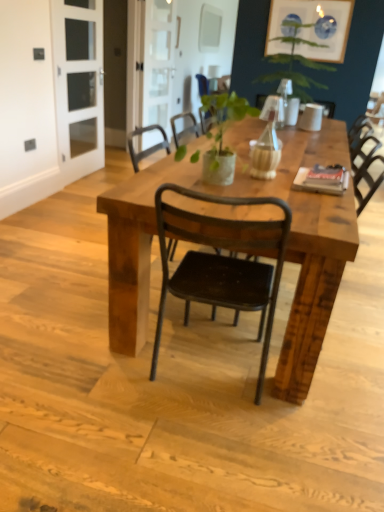
The height and width of the screenshot is (512, 384). Describe the element at coordinates (242, 196) in the screenshot. I see `rustic wood table at center` at that location.

Find the location of a particular element. matte blue glass picture frame at upper right is located at coordinates (310, 28).

The width and height of the screenshot is (384, 512). What are the coordinates of `clear glass screen door at upper center, the 1th screen door viewed from the back` in the screenshot? It's located at (159, 62).

The width and height of the screenshot is (384, 512). What do you see at coordinates (222, 135) in the screenshot? I see `green matte plant at center` at bounding box center [222, 135].

The height and width of the screenshot is (512, 384). I want to click on green leafy plant at upper center, so click(299, 55).

Identify the location of rustic wood table at center. (242, 196).

From the image's perspective, between clear glass door at upper left, the first screen door viewed from the left, and black metal chair at center, arranged as the first chair when viewed from the front, who is located below?

black metal chair at center, arranged as the first chair when viewed from the front, appears lower in the image.

Is clear glass door at upper left, the first screen door viewed from the left, outside of black metal chair at center, the second chair when ordered from back to front?

clear glass door at upper left, the first screen door viewed from the left, lies outside black metal chair at center, the second chair when ordered from back to front,'s area.

Is clear glass door at upper left, the 2th screen door from the back, taller or shorter than black metal chair at center, arranged as the first chair when viewed from the front?

Considering their sizes, clear glass door at upper left, the 2th screen door from the back, has more height than black metal chair at center, arranged as the first chair when viewed from the front.

Are matte blue glass picture frame at upper right and green leafy plant at upper center making contact?

Indeed, matte blue glass picture frame at upper right and green leafy plant at upper center are beside each other and touching.

From the image's perspective, which is below, matte blue glass picture frame at upper right or green leafy plant at upper center?

green leafy plant at upper center is shown below in the image.

Considering the sizes of matte blue glass picture frame at upper right and green leafy plant at upper center in the image, is matte blue glass picture frame at upper right taller or shorter than green leafy plant at upper center?

Clearly, matte blue glass picture frame at upper right is shorter compared to green leafy plant at upper center.

Does point (314, 32) appear closer or farther from the camera than point (290, 31)?

Point (314, 32) is positioned closer to the camera compared to point (290, 31).

From the picture: How much distance is there between matte blue glass picture frame at upper right and green matte plant at center?

The distance of matte blue glass picture frame at upper right from green matte plant at center is 1.75 meters.

From a real-world perspective, is matte blue glass picture frame at upper right over green matte plant at center?

Yes, from a real-world perspective, matte blue glass picture frame at upper right is over green matte plant at center

Is there a large distance between matte blue glass picture frame at upper right and green matte plant at center?

matte blue glass picture frame at upper right is far away from green matte plant at center.

Is matte blue glass picture frame at upper right smaller than green matte plant at center?

Correct, matte blue glass picture frame at upper right occupies less space than green matte plant at center.

Would you say green matte plant at center is inside or outside clear glass screen door at upper center, which is the 2th screen door in front-to-back order?

green matte plant at center exists outside the volume of clear glass screen door at upper center, which is the 2th screen door in front-to-back order.

Is green matte plant at center oriented towards clear glass screen door at upper center, the first screen door when ordered from right to left?

No.

Considering the relative positions of green matte plant at center and clear glass screen door at upper center, the first screen door when ordered from right to left, in the image provided, is green matte plant at center to the left or to the right of clear glass screen door at upper center, the first screen door when ordered from right to left,?

green matte plant at center is to the right of clear glass screen door at upper center, the first screen door when ordered from right to left.

Considering the sizes of green matte plant at center and clear glass screen door at upper center, which is the 2th screen door in front-to-back order, in the image, is green matte plant at center wider or thinner than clear glass screen door at upper center, which is the 2th screen door in front-to-back order,?

In the image, green matte plant at center appears to be wider than clear glass screen door at upper center, which is the 2th screen door in front-to-back order.

From a real-world perspective, between clear glass door at upper left, the second screen door from the right, and black metal chair at center, the 2th chair positioned from the bottom, who is vertically higher?

In real-world perspective, clear glass door at upper left, the second screen door from the right, is above.

Can you confirm if clear glass door at upper left, the second screen door from the right, is smaller than black metal chair at center, the first chair in the top-to-bottom sequence?

Yes, clear glass door at upper left, the second screen door from the right, is smaller than black metal chair at center, the first chair in the top-to-bottom sequence.

Measure the distance from clear glass door at upper left, the 2th screen door from the back, to black metal chair at center, which is counted as the 2th chair, starting from the front.

The distance of clear glass door at upper left, the 2th screen door from the back, from black metal chair at center, which is counted as the 2th chair, starting from the front, is 1.41 meters.

You are a GUI agent. You are given a task and a screenshot of the screen. Output one action in this format:
    pyautogui.click(x=<x>, y=<y>)
    Task: Click on the chair above the clear glass door at upper left, the second screen door from the right (from the image's perspective)
    
    Given the screenshot: What is the action you would take?
    pyautogui.click(x=205, y=120)

Is clear glass screen door at upper center, which ranks as the 2th screen door in left-to-right order, in contact with green leafy plant at upper center?

No.

In the image, is clear glass screen door at upper center, which ranks as the 2th screen door in left-to-right order, on the left side or the right side of green leafy plant at upper center?

From the image, it's evident that clear glass screen door at upper center, which ranks as the 2th screen door in left-to-right order, is to the left of green leafy plant at upper center.

Could you tell me if clear glass screen door at upper center, which is the 2th screen door in front-to-back order, is turned towards green leafy plant at upper center?

No, clear glass screen door at upper center, which is the 2th screen door in front-to-back order, is not turned towards green leafy plant at upper center.

From the image's perspective, between clear glass screen door at upper center, the 1th screen door viewed from the back, and green leafy plant at upper center, which one is located above?

From the image's view, clear glass screen door at upper center, the 1th screen door viewed from the back, is above.

From the image's perspective, would you say green matte plant at center is positioned over rustic wood table at center?

Yes.

Is green matte plant at center positioned far away from rustic wood table at center?

green matte plant at center is actually quite close to rustic wood table at center.

Is green matte plant at center located outside rustic wood table at center?

Yes, green matte plant at center is outside of rustic wood table at center.

Which is less distant, (218,179) or (231,192)?

Positioned in front is point (231,192).

Identify the location of the 1st chair to the right of the clear glass door at upper left, the 2th screen door from the back, counting from the anchor's position. The width and height of the screenshot is (384, 512). (222, 258).

Locate an element on the screen. houseplant located below the matte blue glass picture frame at upper right (from the image's perspective) is located at coordinates (299, 55).

From the picture: From the image, which object appears to be farther from clear glass door at upper left, placed as the first screen door when sorted from front to back, green matte plant at center or black metal chair at center, arranged as the first chair when viewed from the front?

black metal chair at center, arranged as the first chair when viewed from the front, lies further to clear glass door at upper left, placed as the first screen door when sorted from front to back, than the other object.

Looking at this image, considering their positions, is black metal chair at center, arranged as the first chair when viewed from the front, positioned further to green leafy plant at upper center than rustic wood table at center?

black metal chair at center, arranged as the first chair when viewed from the front, is further to green leafy plant at upper center.

Based on their spatial positions, is black metal chair at center, the 2th chair positioned from the bottom, or green leafy plant at upper center further from green matte plant at center?

The object further to green matte plant at center is green leafy plant at upper center.

From the image, which object appears to be farther from green matte plant at center, black metal chair at center, which ranks as the first chair in bottom-to-top order, or green leafy plant at upper center?

The object further to green matte plant at center is green leafy plant at upper center.

In the scene shown: Considering their positions, is rustic wood table at center positioned closer to black metal chair at center, the first chair in the top-to-bottom sequence, than clear glass screen door at upper center, which is the 2th screen door in front-to-back order?

Among the two, clear glass screen door at upper center, which is the 2th screen door in front-to-back order, is located nearer to black metal chair at center, the first chair in the top-to-bottom sequence.

When comparing their distances from black metal chair at center, the second chair when ordered from back to front, does matte blue glass picture frame at upper right or green leafy plant at upper center seem closer?

Based on the image, green leafy plant at upper center appears to be nearer to black metal chair at center, the second chair when ordered from back to front.

Looking at the image, which one is located closer to black metal chair at center, which ranks as the first chair in bottom-to-top order, clear glass door at upper left, placed as the first screen door when sorted from front to back, or rustic wood table at center?

Based on the image, rustic wood table at center appears to be nearer to black metal chair at center, which ranks as the first chair in bottom-to-top order.

From the image, which object appears to be nearer to clear glass door at upper left, the 2th screen door from the back, green leafy plant at upper center or rustic wood table at center?

Among the two, green leafy plant at upper center is located nearer to clear glass door at upper left, the 2th screen door from the back.

Identify the location of plant positioned between black metal chair at center, arranged as the first chair when viewed from the front, and matte blue glass picture frame at upper right from near to far. pos(222,135).

Identify the location of screen door between clear glass door at upper left, placed as the first screen door when sorted from front to back, and black metal chair at center, which is counted as the 2th chair, starting from the front, in the front-back direction. The image size is (384, 512). (159, 62).

This screenshot has width=384, height=512. In order to click on screen door between rustic wood table at center and clear glass screen door at upper center, the 1th screen door viewed from the back, from front to back in this screenshot , I will do `click(78, 85)`.

This screenshot has width=384, height=512. I want to click on plant located between rustic wood table at center and clear glass door at upper left, the second screen door from the right, in the depth direction, so click(222, 135).